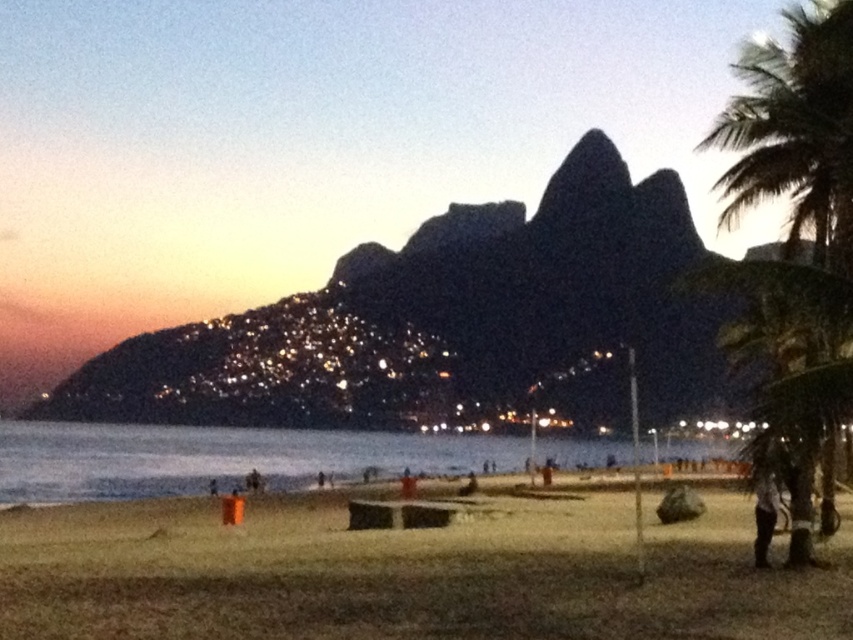
You are standing on the beach and want to hide behind the green leafy palm tree at right to avoid being seen by someone wearing camouflage fabric pants at lower right. Will you be visible to them?

The green leafy palm tree at right is positioned on the right side of camouflage fabric pants at lower right, so if you hide behind the palm tree, you would be to the right of the person wearing the camouflage fabric pants. Depending on their line of sight, you might still be visible unless the tree itself blocks their view.

You are standing on the brown sand at lower center and want to walk towards the green leafy palm tree at right. Which direction should you head?

You should head upwards towards the green leafy palm tree at right since the brown sand at lower center is located below it.

You are standing on the beach looking towards the ocean. You see the brown sand at lower center and the green leafy palm tree at right. Which object is closer to your left side?

The brown sand at lower center is to the left of the green leafy palm tree at right, so it is closer to your left side.